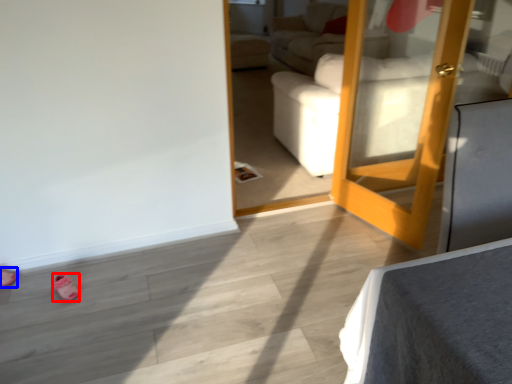
Question: Which object appears closest to the camera in this image, shoe (highlighted by a red box) or shoe (highlighted by a blue box)?

Choices:
 (A) shoe
 (B) shoe

Answer: (A)